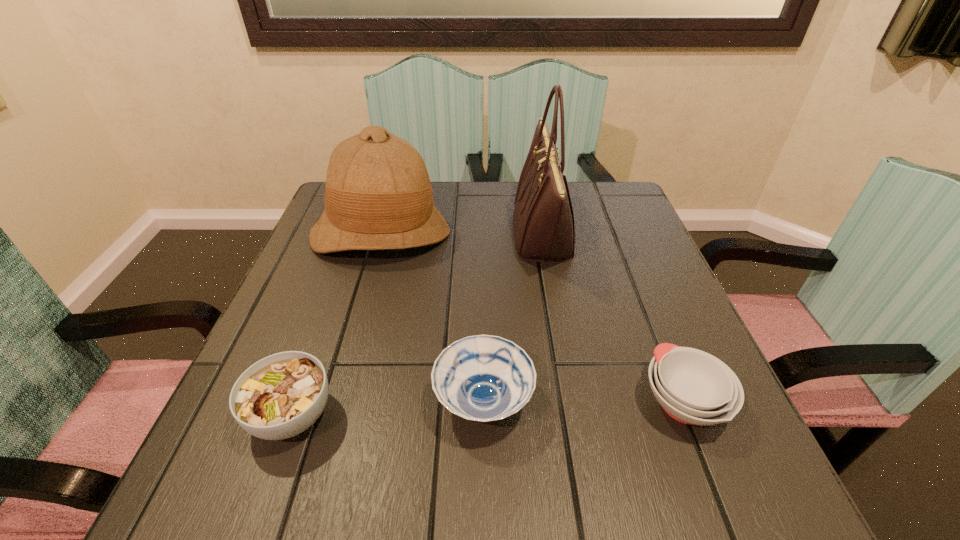
This screenshot has height=540, width=960. I want to click on vacant space at the far edge of the desktop, so click(x=489, y=198).

Identify the location of vacant space at the near edge of the desktop. (385, 452).

Where is `blank space at the left edge`? The image size is (960, 540). blank space at the left edge is located at coordinates (288, 322).

At what (x,y) coordinates should I click in order to perform the action: click on vacant space at the right edge of the desktop. Please return your answer as a coordinate pair (x, y). The image size is (960, 540). Looking at the image, I should click on (653, 275).

Where is `vacant region at the far right corner of the desktop`? This screenshot has width=960, height=540. vacant region at the far right corner of the desktop is located at coordinates (576, 213).

You are a GUI agent. You are given a task and a screenshot of the screen. Output one action in this format:
    pyautogui.click(x=<x>, y=<y>)
    Task: Click on the vacant space at the near right corner
    This screenshot has width=960, height=540.
    Given the screenshot: What is the action you would take?
    pyautogui.click(x=695, y=501)

Where is `free space between the second soup bowl from left to right and the rightmost object`? Image resolution: width=960 pixels, height=540 pixels. free space between the second soup bowl from left to right and the rightmost object is located at coordinates (584, 401).

The width and height of the screenshot is (960, 540). I want to click on free space that is in between the fourth shortest object and the handbag, so click(x=462, y=234).

Identify the location of unoccupied position between the second soup bowl from right to left and the rightmost soup bowl. click(584, 401).

The height and width of the screenshot is (540, 960). What are the coordinates of `vacant space that's between the rightmost object and the second soup bowl from right to left` in the screenshot? It's located at (584, 401).